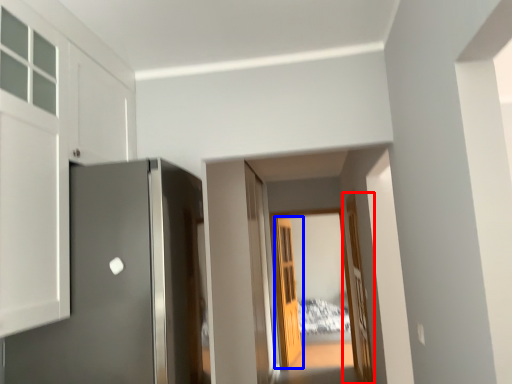
Question: Which object is closer to the camera taking this photo, door (highlighted by a red box) or door (highlighted by a blue box)?

Choices:
 (A) door
 (B) door

Answer: (A)